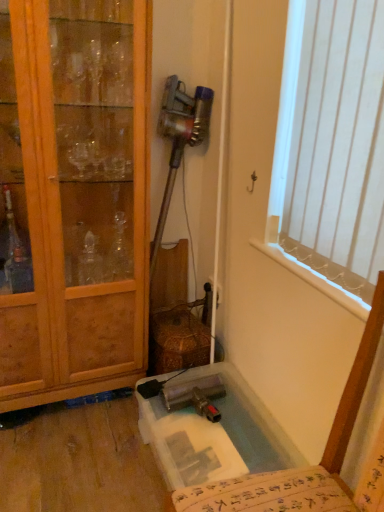
The image size is (384, 512). Find the location of `translucent plastic chair at lower right`. translucent plastic chair at lower right is located at coordinates (313, 466).

Where is `white vertical blinds at upper right`? Image resolution: width=384 pixels, height=512 pixels. white vertical blinds at upper right is located at coordinates (332, 146).

Locate an element on the screen. This screenshot has width=384, height=512. clear plastic bath at lower center is located at coordinates (216, 435).

Which object is positioned more to the right, white vertical blinds at upper right or clear plastic bath at lower center?

Positioned to the right is white vertical blinds at upper right.

Consider the image. Choose the correct answer: Is white vertical blinds at upper right inside clear plastic bath at lower center or outside it?

white vertical blinds at upper right exists outside the volume of clear plastic bath at lower center.

From the image's perspective, is white vertical blinds at upper right positioned above or below clear plastic bath at lower center?

white vertical blinds at upper right is situated higher than clear plastic bath at lower center in the image.

Considering the sizes of objects white vertical blinds at upper right and clear plastic bath at lower center in the image provided, who is wider, white vertical blinds at upper right or clear plastic bath at lower center?

clear plastic bath at lower center is wider.

Who is more distant, clear plastic bath at lower center or white vertical blinds at upper right?

Positioned behind is clear plastic bath at lower center.

Consider the image. Can you confirm if clear plastic bath at lower center is positioned to the right of white vertical blinds at upper right?

No, clear plastic bath at lower center is not to the right of white vertical blinds at upper right.

Is point (232, 405) closer or farther from the camera than point (360, 201)?

Point (232, 405) appears to be farther away from the viewer than point (360, 201).

How different are the orientations of clear plastic bath at lower center and white vertical blinds at upper right in degrees?

They differ by 0.801 degrees in their facing directions.

From a real-world perspective, which object stands above the other?

From a 3D spatial view, wooden cabinet at left is above.

Is clear plastic bath at lower center completely or partially outside of wooden cabinet at left?

Yes.

In the scene shown: Is clear plastic bath at lower center next to wooden cabinet at left?

No.

From the image's perspective, is clear plastic bath at lower center beneath wooden cabinet at left?

Correct, clear plastic bath at lower center appears lower than wooden cabinet at left in the image.

Between wooden cabinet at left and translucent plastic chair at lower right, which one has larger width?

Wider between the two is translucent plastic chair at lower right.

Are wooden cabinet at left and translucent plastic chair at lower right making contact?

wooden cabinet at left is not next to translucent plastic chair at lower right, and they're not touching.

Which is in front, point (77, 136) or point (351, 371)?

Point (351, 371)

I want to click on chair located on the right of wooden cabinet at left, so click(313, 466).

Is clear plastic bath at lower center situated inside translucent plastic chair at lower right or outside?

clear plastic bath at lower center is not enclosed by translucent plastic chair at lower right.

Does clear plastic bath at lower center have a lesser width compared to translucent plastic chair at lower right?

Indeed, clear plastic bath at lower center has a lesser width compared to translucent plastic chair at lower right.

From the picture: Can you see clear plastic bath at lower center touching translucent plastic chair at lower right?

No, clear plastic bath at lower center is not making contact with translucent plastic chair at lower right.

Which is closer, (159, 455) or (347, 385)?

The point (347, 385) is closer.

This screenshot has height=512, width=384. Find the location of `cabinetry lying below the white vertical blinds at upper right (from the image's perspective)`. cabinetry lying below the white vertical blinds at upper right (from the image's perspective) is located at coordinates (74, 197).

Between wooden cabinet at left and white vertical blinds at upper right, which one appears on the left side from the viewer's perspective?

From the viewer's perspective, wooden cabinet at left appears more on the left side.

Can we say wooden cabinet at left lies outside white vertical blinds at upper right?

That's correct, wooden cabinet at left is outside of white vertical blinds at upper right.

Does wooden cabinet at left have a larger size compared to white vertical blinds at upper right?

Yes, wooden cabinet at left is bigger than white vertical blinds at upper right.

Find the location of `window on the right of translucent plastic chair at lower right`. window on the right of translucent plastic chair at lower right is located at coordinates (332, 146).

Is white vertical blinds at upper right not near translucent plastic chair at lower right?

No, white vertical blinds at upper right is in close proximity to translucent plastic chair at lower right.

Who is more distant, white vertical blinds at upper right or translucent plastic chair at lower right?

white vertical blinds at upper right is more distant.

Considering the points (339, 213) and (208, 509), which point is in front, point (339, 213) or point (208, 509)?

The point (208, 509) is more forward.

Find the location of a particular element. This screenshot has width=384, height=512. window that appears above the clear plastic bath at lower center (from a real-world perspective) is located at coordinates (332, 146).

The image size is (384, 512). Find the location of `window that is above the clear plastic bath at lower center (from the image's perspective)`. window that is above the clear plastic bath at lower center (from the image's perspective) is located at coordinates (332, 146).

Looking at the image, which one is located further to translucent plastic chair at lower right, wooden cabinet at left or clear plastic bath at lower center?

Based on the image, wooden cabinet at left appears to be further to translucent plastic chair at lower right.

Which object lies nearer to the anchor point clear plastic bath at lower center, white vertical blinds at upper right or wooden cabinet at left?

The object closer to clear plastic bath at lower center is wooden cabinet at left.

Looking at the image, which one is located further to translucent plastic chair at lower right, clear plastic bath at lower center or white vertical blinds at upper right?

The object further to translucent plastic chair at lower right is clear plastic bath at lower center.

From the image, which object appears to be nearer to wooden cabinet at left, translucent plastic chair at lower right or white vertical blinds at upper right?

white vertical blinds at upper right is closer to wooden cabinet at left.

From the picture: Looking at the image, which one is located closer to wooden cabinet at left, translucent plastic chair at lower right or clear plastic bath at lower center?

Based on the image, clear plastic bath at lower center appears to be nearer to wooden cabinet at left.

Considering their positions, is wooden cabinet at left positioned closer to white vertical blinds at upper right than clear plastic bath at lower center?

wooden cabinet at left is closer to white vertical blinds at upper right.

When comparing their distances from translucent plastic chair at lower right, does white vertical blinds at upper right or clear plastic bath at lower center seem further?

clear plastic bath at lower center is positioned further to the anchor translucent plastic chair at lower right.

Looking at the image, which one is located further to translucent plastic chair at lower right, wooden cabinet at left or white vertical blinds at upper right?

The object further to translucent plastic chair at lower right is wooden cabinet at left.

I want to click on cabinetry positioned between translucent plastic chair at lower right and clear plastic bath at lower center from near to far, so click(x=74, y=197).

Find the location of a particular element. This screenshot has height=512, width=384. chair between wooden cabinet at left and white vertical blinds at upper right in the horizontal direction is located at coordinates pyautogui.click(x=313, y=466).

You are a GUI agent. You are given a task and a screenshot of the screen. Output one action in this format:
    pyautogui.click(x=<x>, y=<y>)
    Task: Click on the chair between white vertical blinds at upper right and clear plastic bath at lower center in the up-down direction
    The height and width of the screenshot is (512, 384).
    Given the screenshot: What is the action you would take?
    [x=313, y=466]

Locate an element on the screen. The height and width of the screenshot is (512, 384). cabinetry between white vertical blinds at upper right and clear plastic bath at lower center in the vertical direction is located at coordinates (74, 197).